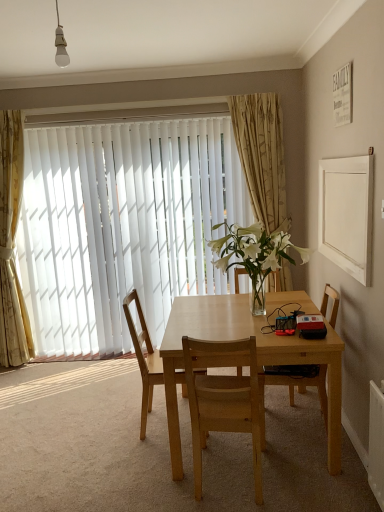
Find the location of `free point below gold textured curtain at left, which is the first curtain in left-to-right order (from a real-world perspective)`. free point below gold textured curtain at left, which is the first curtain in left-to-right order (from a real-world perspective) is located at coordinates (37, 361).